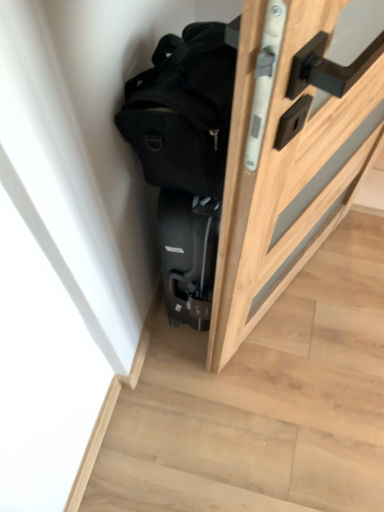
Image resolution: width=384 pixels, height=512 pixels. Find the location of `empty space that is ontop of black suitcase at lower left (from a real-world perspective)`. empty space that is ontop of black suitcase at lower left (from a real-world perspective) is located at coordinates point(281,381).